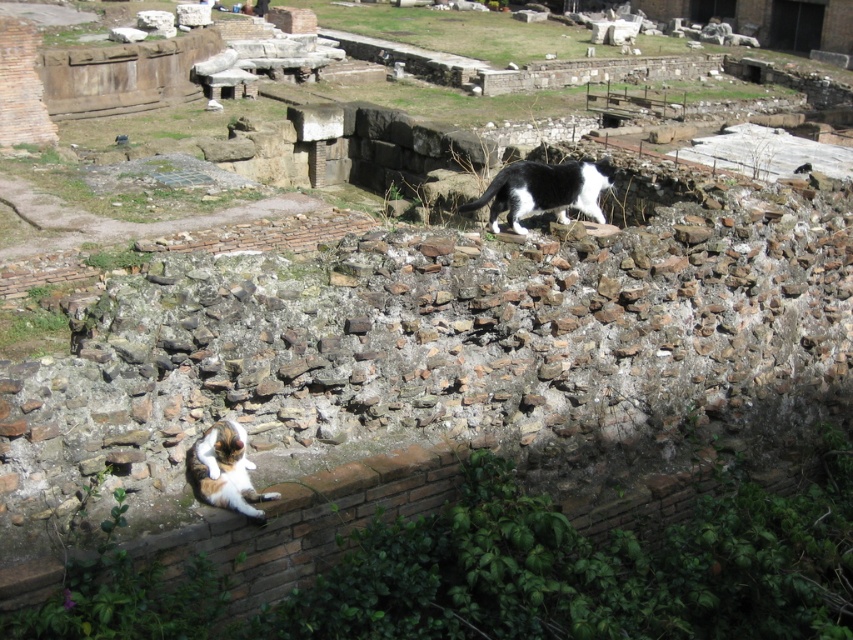
Question: Which of the following is the farthest from the observer?

Choices:
 (A) (196, 490)
 (B) (573, 202)

Answer: (B)

Question: From the image, what is the correct spatial relationship of black and white fur cat at upper right in relation to calico fur cat at lower left?

Choices:
 (A) above
 (B) below

Answer: (A)

Question: Does black and white fur cat at upper right appear under calico fur cat at lower left?

Choices:
 (A) yes
 (B) no

Answer: (B)

Question: Which of the following is the closest to the observer?

Choices:
 (A) calico fur cat at lower left
 (B) black and white fur cat at upper right

Answer: (A)

Question: From the image, what is the correct spatial relationship of black and white fur cat at upper right in relation to calico fur cat at lower left?

Choices:
 (A) above
 (B) below

Answer: (A)